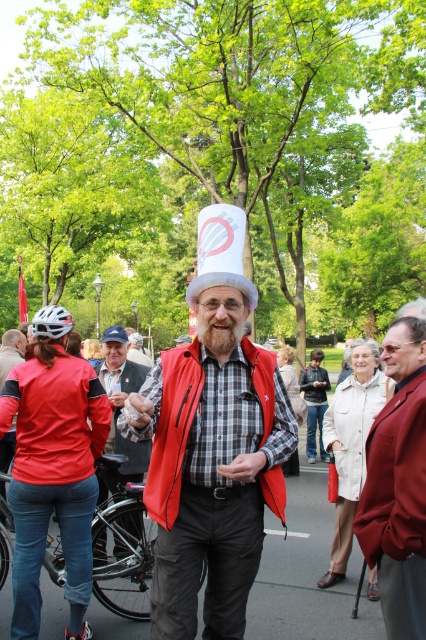
Question: Which of the following is the farthest from the observer?

Choices:
 (A) (31, 371)
 (B) (224, 204)

Answer: (A)

Question: Which of the following is the closest to the observer?

Choices:
 (A) white paper hat at center
 (B) matte red jacket at left
 (C) white cotton coat at center
 (D) matte black vest at center

Answer: (B)

Question: Can you confirm if matte black vest at center is wider than white cotton coat at center?

Choices:
 (A) yes
 (B) no

Answer: (B)

Question: Which is nearer to the brown fuzzy beard at center?

Choices:
 (A) white fabric hat at center
 (B) matte black vest at center
 (C) matte red jacket at left

Answer: (A)

Question: Observing the image, what is the correct spatial positioning of white matte bicycle helmet at left in reference to white paper hat at center?

Choices:
 (A) above
 (B) below

Answer: (A)

Question: Is matte red jacket at left positioned at the back of white cotton coat at center?

Choices:
 (A) no
 (B) yes

Answer: (A)